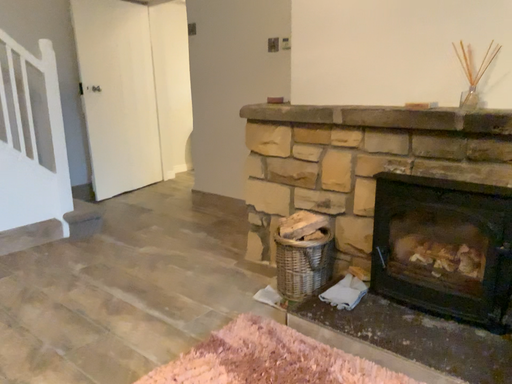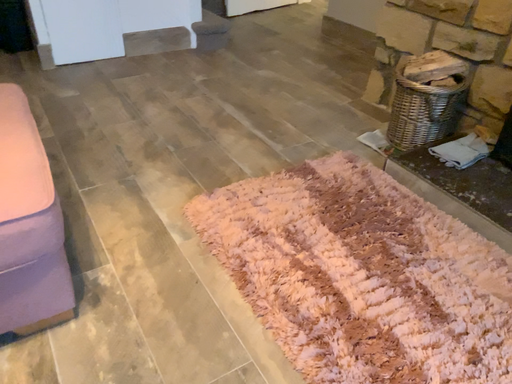
Question: Which way did the camera rotate in the video?

Choices:
 (A) rotated right
 (B) rotated left

Answer: (B)